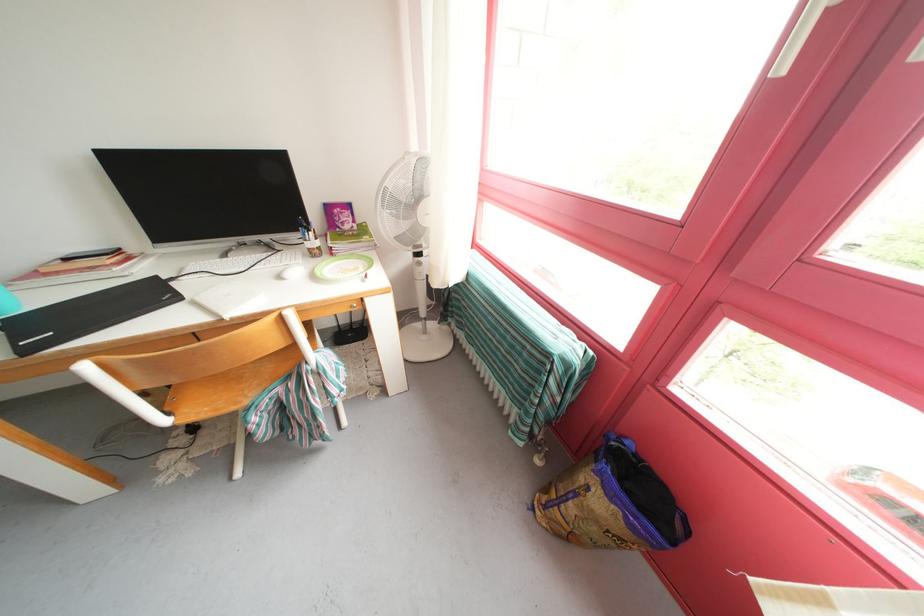
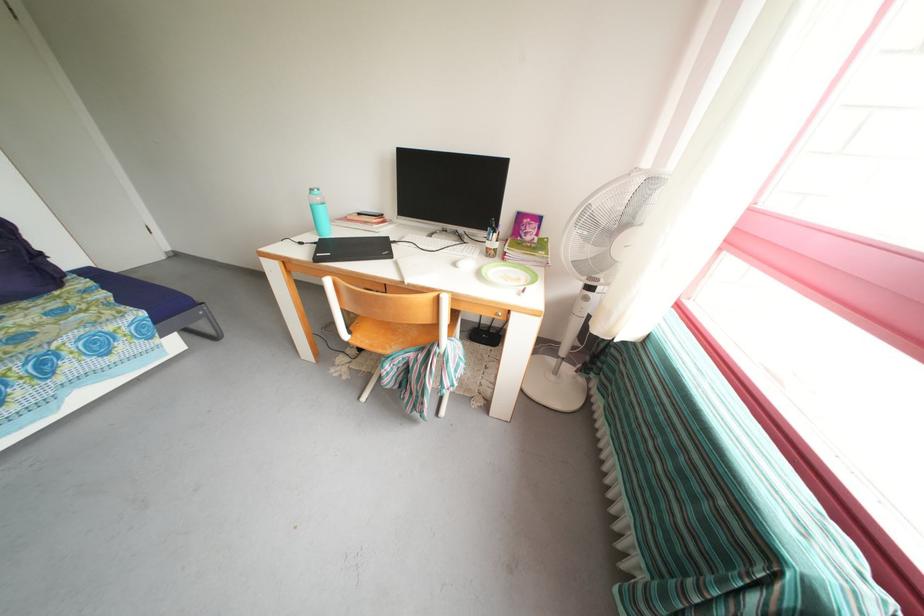
In the second image, find the point that corresponds to (315,256) in the first image.

(494, 254)